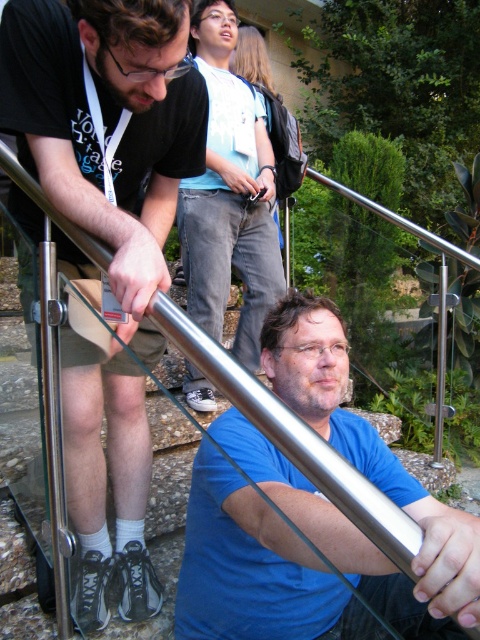
You are standing in the outdoor area and see two people wearing matte black shirt at center and matte blue shirt at center. Which one is positioned to the left?

The matte black shirt at center is to the left of the matte blue shirt at center.

You are a photographer trying to capture the matte black shirt at center and the matte blue shirt at center in the same frame. Since both are at the center, which one is more likely to be visible in the photo?

The matte black shirt at center is positioned over matte blue shirt at center, so the matte black shirt at center will be more visible in the photo.

You are standing at the bottom of the stairs and see two people wearing shirts of different colors. The person in the matte black shirt at center and the person in the matte blue shirt at center. Which shirt color is visible more in front?

The matte black shirt at center is more visible in front because the matte blue shirt at center is positioned behind it.